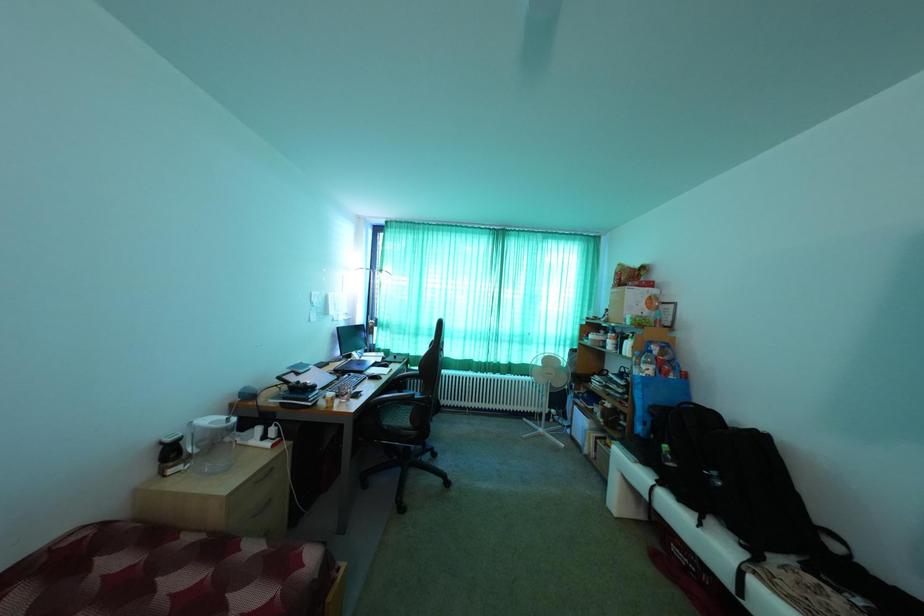
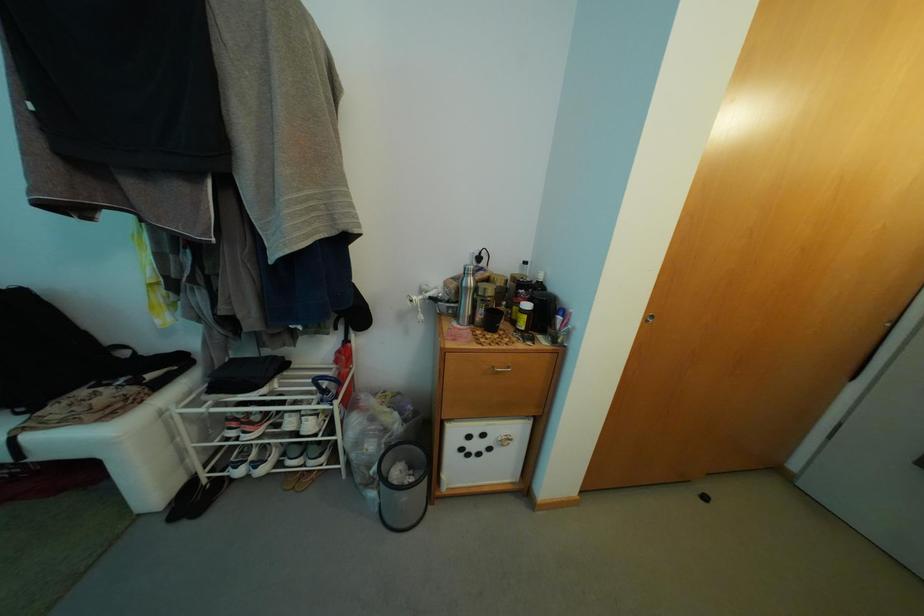
Based on the continuous images, in which direction is the camera rotating?

The camera rotated toward right-down.